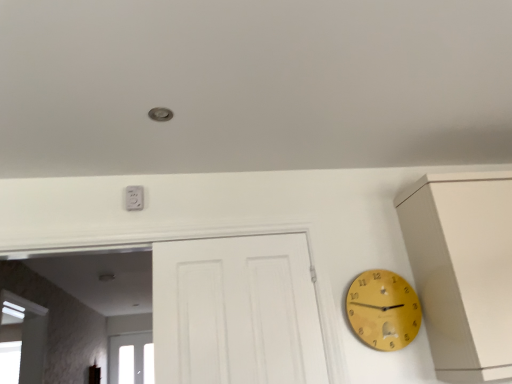
What is the approximate height of white plastic outlet at upper center?

white plastic outlet at upper center is 4.69 inches tall.

What do you see at coordinates (383, 310) in the screenshot? I see `yellow wooden clock at right` at bounding box center [383, 310].

Find the location of a particular element. white plastic outlet at upper center is located at coordinates (134, 198).

Where is `wall clock on the right of transparent glass window at lower left`? This screenshot has width=512, height=384. wall clock on the right of transparent glass window at lower left is located at coordinates (383, 310).

How different are the orientations of transparent glass window at lower left and yellow wooden clock at right in degrees?

The angular difference between transparent glass window at lower left and yellow wooden clock at right is 2.26 degrees.

How distant is transparent glass window at lower left from yellow wooden clock at right?

transparent glass window at lower left and yellow wooden clock at right are 13.28 feet apart from each other.

Choose the correct answer: Is transparent glass window at lower left inside yellow wooden clock at right or outside it?

transparent glass window at lower left cannot be found inside yellow wooden clock at right.

Visually, is white plastic outlet at upper center positioned to the left or to the right of yellow wooden clock at right?

white plastic outlet at upper center is positioned on yellow wooden clock at right's left side.

Would you say yellow wooden clock at right is part of white plastic outlet at upper center's contents?

No, yellow wooden clock at right is not a part of white plastic outlet at upper center.

Does white plastic outlet at upper center touch yellow wooden clock at right?

No, white plastic outlet at upper center is not making contact with yellow wooden clock at right.

In the image, is white plastic outlet at upper center positioned in front of or behind yellow wooden clock at right?

Visually, white plastic outlet at upper center is located behind yellow wooden clock at right.

Considering the relative sizes of transparent glass window at lower left and white plastic outlet at upper center in the image provided, is transparent glass window at lower left thinner than white plastic outlet at upper center?

Incorrect, the width of transparent glass window at lower left is not less than that of white plastic outlet at upper center.

Is transparent glass window at lower left inside or outside of white plastic outlet at upper center?

transparent glass window at lower left is outside white plastic outlet at upper center.

Is the surface of transparent glass window at lower left in direct contact with white plastic outlet at upper center?

transparent glass window at lower left and white plastic outlet at upper center are not in contact.

Considering the relative positions of transparent glass window at lower left and white plastic outlet at upper center in the image provided, is transparent glass window at lower left in front of white plastic outlet at upper center?

That is False.

In the scene shown: Is yellow wooden clock at right wider or thinner than transparent glass window at lower left?

Clearly, yellow wooden clock at right has less width compared to transparent glass window at lower left.

Could transparent glass window at lower left be considered to be inside yellow wooden clock at right?

No, yellow wooden clock at right does not contain transparent glass window at lower left.

From a real-world perspective, is yellow wooden clock at right physically below transparent glass window at lower left?

Yes, from a real-world perspective, yellow wooden clock at right is under transparent glass window at lower left.

Which of these two, white plastic outlet at upper center or transparent glass window at lower left, is bigger?

With larger size is transparent glass window at lower left.

Is the surface of white plastic outlet at upper center in direct contact with transparent glass window at lower left?

There is a gap between white plastic outlet at upper center and transparent glass window at lower left.

Looking at their sizes, would you say white plastic outlet at upper center is wider or thinner than transparent glass window at lower left?

Considering their sizes, white plastic outlet at upper center looks slimmer than transparent glass window at lower left.

The height and width of the screenshot is (384, 512). What are the coordinates of `wall clock beneath the white plastic outlet at upper center (from a real-world perspective)` in the screenshot? It's located at 383,310.

Is point (349, 299) closer or farther from the camera than point (127, 204)?

Point (349, 299).

Is yellow wooden clock at right inside or outside of white plastic outlet at upper center?

yellow wooden clock at right is outside white plastic outlet at upper center.

Based on the photo, considering the sizes of objects yellow wooden clock at right and white plastic outlet at upper center in the image provided, who is thinner, yellow wooden clock at right or white plastic outlet at upper center?

With smaller width is white plastic outlet at upper center.

Where is `window behind the yellow wooden clock at right`? The height and width of the screenshot is (384, 512). window behind the yellow wooden clock at right is located at coordinates (131, 359).

Find the location of a particular element. This screenshot has width=512, height=384. electric outlet located above the yellow wooden clock at right (from a real-world perspective) is located at coordinates (134, 198).

When comparing their distances from transparent glass window at lower left, does yellow wooden clock at right or white plastic outlet at upper center seem closer?

Among the two, white plastic outlet at upper center is located nearer to transparent glass window at lower left.

Looking at the image, which one is located closer to white plastic outlet at upper center, yellow wooden clock at right or transparent glass window at lower left?

yellow wooden clock at right is positioned closer to the anchor white plastic outlet at upper center.

From the image, which object appears to be nearer to white plastic outlet at upper center, transparent glass window at lower left or yellow wooden clock at right?

Based on the image, yellow wooden clock at right appears to be nearer to white plastic outlet at upper center.

Based on their spatial positions, is transparent glass window at lower left or white plastic outlet at upper center further from yellow wooden clock at right?

The object further to yellow wooden clock at right is transparent glass window at lower left.

Looking at the image, which one is located further to transparent glass window at lower left, white plastic outlet at upper center or yellow wooden clock at right?

Among the two, yellow wooden clock at right is located further to transparent glass window at lower left.

Estimate the real-world distances between objects in this image. Which object is closer to yellow wooden clock at right, white plastic outlet at upper center or transparent glass window at lower left?

white plastic outlet at upper center.

The width and height of the screenshot is (512, 384). In order to click on electric outlet between yellow wooden clock at right and transparent glass window at lower left in the front-back direction in this screenshot , I will do `click(134, 198)`.